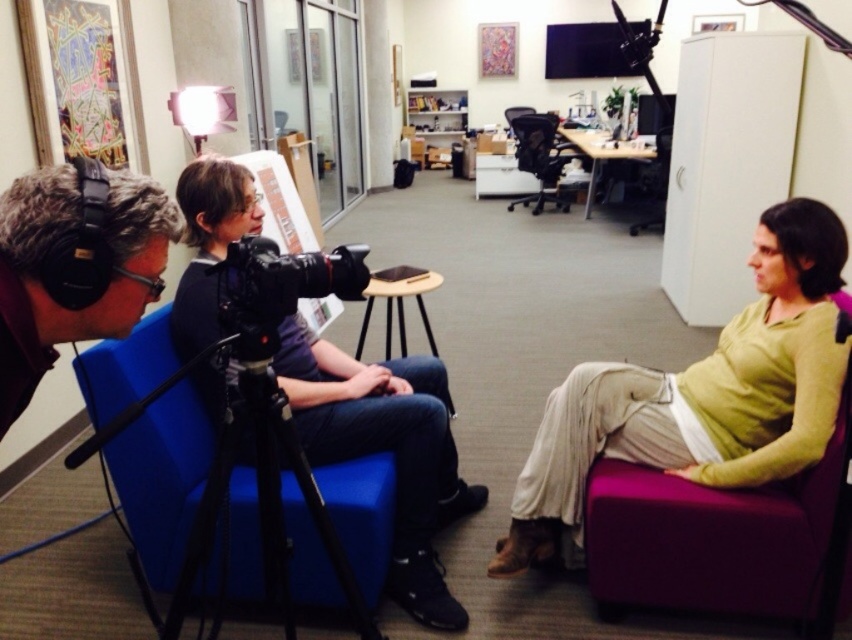
You are a technician adjusting the camera position in the studio. The camera is currently 37.87 inches away from the point at coordinates point [27,316]. If you need to ensure the camera is exactly 40 inches away from that point for optimal focus, should you move the camera closer or farther away?

The camera is currently 37.87 inches away from the point at coordinates point [27,316]. To reach the desired 40 inches for optimal focus, you need to move the camera farther away from the point.

You are standing at the origin of the coordinate system in the studio. There are two points marked in the scene, point (764,488) and point (337,264). Which point is farther away from you?

Point (764,488) is behind point (337,264), so it is farther away from you.

In the scene shown: You are setting up a video call and need to locate your headphones and camera tripod. Based on the scene, where is the black matte headphones at left in relation to the black metal tripod at center?

The black matte headphones at left are positioned to the left of the black metal tripod at center.